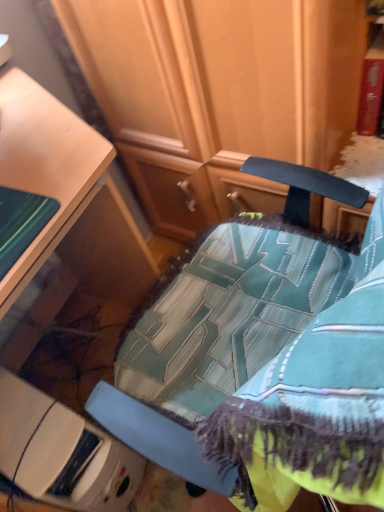
Question: Is white plastic container at lower left to the right of teal fabric chair at center from the viewer's perspective?

Choices:
 (A) yes
 (B) no

Answer: (B)

Question: From a real-world perspective, is white plastic container at lower left on teal fabric chair at center?

Choices:
 (A) yes
 (B) no

Answer: (B)

Question: Is white plastic container at lower left looking in the opposite direction of teal fabric chair at center?

Choices:
 (A) yes
 (B) no

Answer: (B)

Question: Is white plastic container at lower left closer to camera compared to teal fabric chair at center?

Choices:
 (A) no
 (B) yes

Answer: (A)

Question: Considering the relative positions of white plastic container at lower left and teal fabric chair at center in the image provided, is white plastic container at lower left behind teal fabric chair at center?

Choices:
 (A) yes
 (B) no

Answer: (A)

Question: Can you confirm if white plastic container at lower left is positioned to the left of teal fabric chair at center?

Choices:
 (A) yes
 (B) no

Answer: (A)

Question: From a real-world perspective, is teal fabric chair at center under white plastic container at lower left?

Choices:
 (A) no
 (B) yes

Answer: (A)

Question: Is teal fabric chair at center not near white plastic container at lower left?

Choices:
 (A) yes
 (B) no

Answer: (B)

Question: Is white plastic container at lower left surrounded by teal fabric chair at center?

Choices:
 (A) no
 (B) yes

Answer: (A)

Question: Considering the relative positions of teal fabric chair at center and white plastic container at lower left in the image provided, is teal fabric chair at center to the right of white plastic container at lower left from the viewer's perspective?

Choices:
 (A) yes
 (B) no

Answer: (A)

Question: Is teal fabric chair at center positioned with its back to white plastic container at lower left?

Choices:
 (A) no
 (B) yes

Answer: (A)

Question: Can you confirm if teal fabric chair at center is positioned to the left of white plastic container at lower left?

Choices:
 (A) no
 (B) yes

Answer: (A)

Question: Does point (170, 431) appear closer or farther from the camera than point (91, 507)?

Choices:
 (A) farther
 (B) closer

Answer: (B)